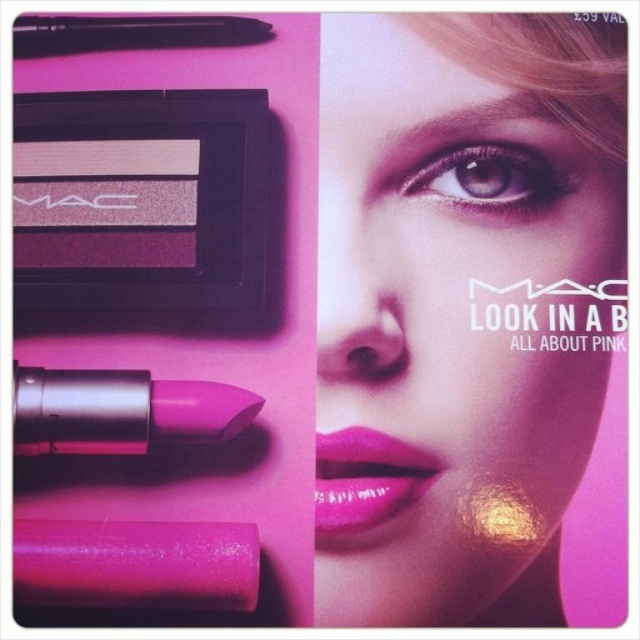
Question: Which of the following is the farthest from the observer?

Choices:
 (A) (532, 192)
 (B) (426, 476)
 (C) (582, 42)

Answer: (C)

Question: In this image, where is matte pink eye at upper center located relative to matte pink lipstick at center?

Choices:
 (A) left
 (B) right

Answer: (B)

Question: Is matte pink lipstick at lower left positioned at the back of shiny pink lipstick at center?

Choices:
 (A) no
 (B) yes

Answer: (B)

Question: Estimate the real-world distances between objects in this image. Which object is closer to the matte pink lipstick at center?

Choices:
 (A) matte black pen at upper left
 (B) matte pink lipstick at lower left
 (C) shiny pink lipstick at center
 (D) matte pink eye at upper center

Answer: (C)

Question: Does shiny pink lipstick at center appear under matte black pen at upper left?

Choices:
 (A) no
 (B) yes

Answer: (B)

Question: Which point is farther to the camera?

Choices:
 (A) [438, 198]
 (B) [328, 442]

Answer: (A)